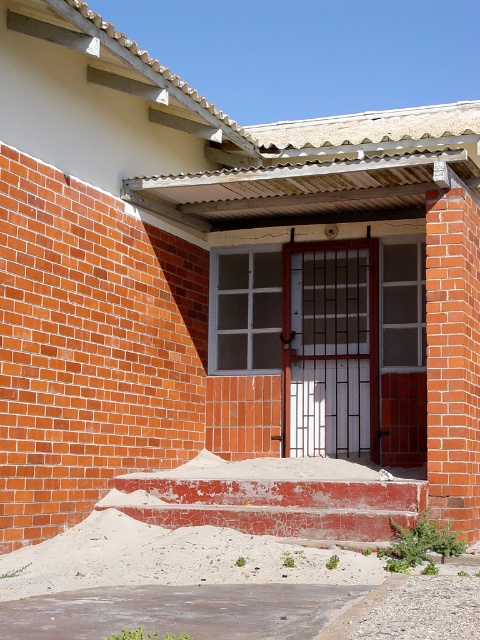
You are standing in front of the building entrance. You see the white matte door at center and the red brick wall at right. Which object is positioned to the left of the other?

The white matte door at center is positioned to the left of the red brick wall at right.

You are standing at the entrance of the building and want to locate the white matte door at center. Based on the coordinates provided, where should you look relative to the entrance?

The white matte door at center is located at coordinates point (330, 349), which means it is positioned slightly to the right and lower than the center point of the entrance area.

You are a painter who needs to decide whether to paint the white matte door at center and the red brick wall at right. Based on their sizes, which object should you paint first if you want to start with the taller one?

The white matte door at center is not as tall as the red brick wall at right, so you should paint the red brick wall at right first since it is taller.